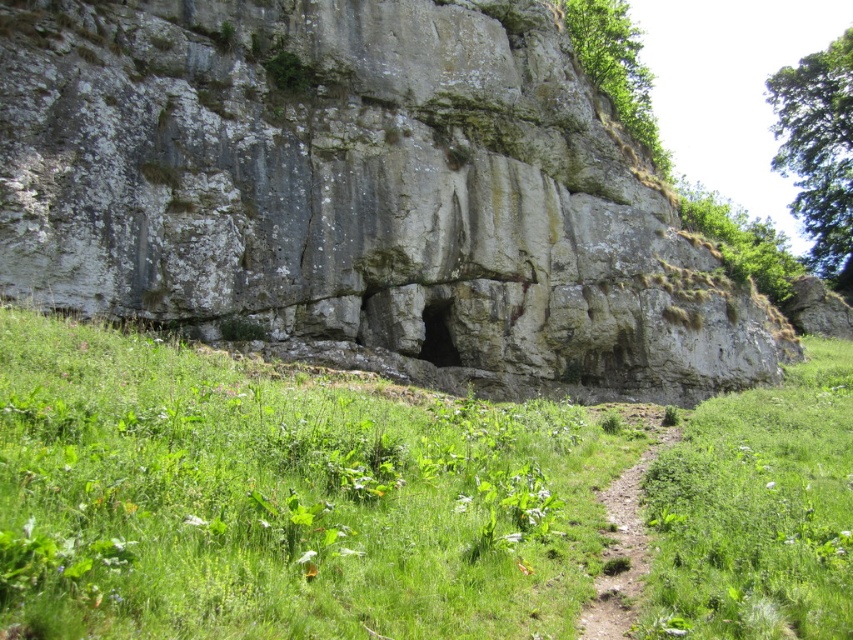
Question: Considering the relative positions of green grassy at lower right and smooth stone hole at center in the image provided, where is green grassy at lower right located with respect to smooth stone hole at center?

Choices:
 (A) left
 (B) right

Answer: (B)

Question: Is gray stone cave at center below brown dirt path at center?

Choices:
 (A) no
 (B) yes

Answer: (A)

Question: Which is nearer to the gray stone cave at center?

Choices:
 (A) green grassy at lower right
 (B) green grassy at center

Answer: (B)

Question: Considering the real-world distances, which object is farthest from the brown dirt path at center?

Choices:
 (A) smooth stone hole at center
 (B) green grassy at center

Answer: (A)

Question: Can you confirm if green grassy at lower right is positioned to the right of smooth stone hole at center?

Choices:
 (A) no
 (B) yes

Answer: (B)

Question: Which is nearer to the green grassy at lower right?

Choices:
 (A) gray stone cave at center
 (B) smooth stone hole at center
 (C) brown dirt path at center

Answer: (C)